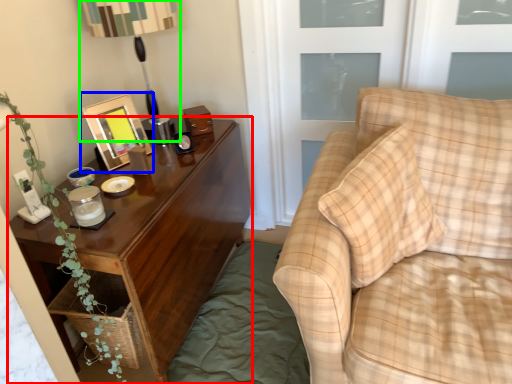
Question: Estimate the real-world distances between objects in this image. Which object is closer to nightstand (highlighted by a red box), picture frame (highlighted by a blue box) or table lamp (highlighted by a green box)?

Choices:
 (A) picture frame
 (B) table lamp

Answer: (A)